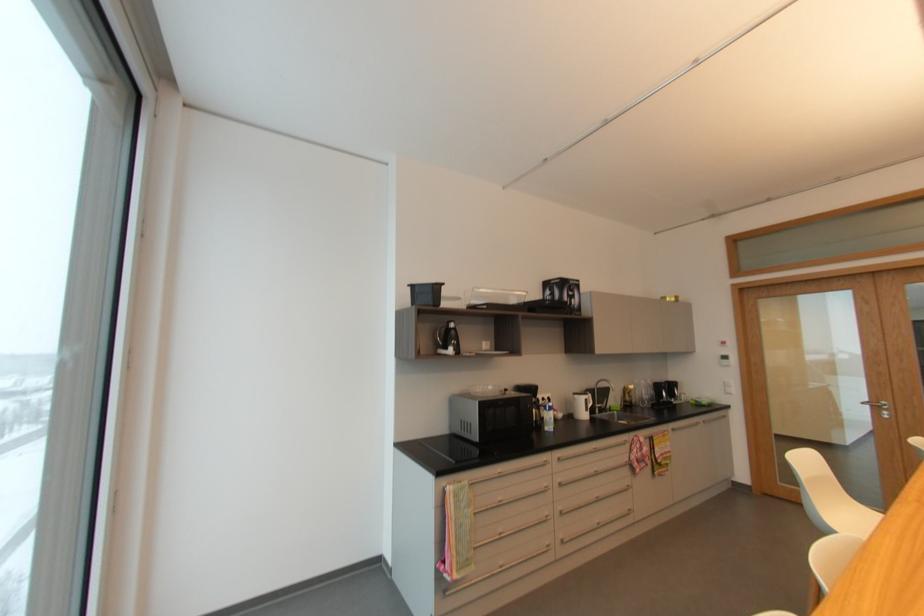
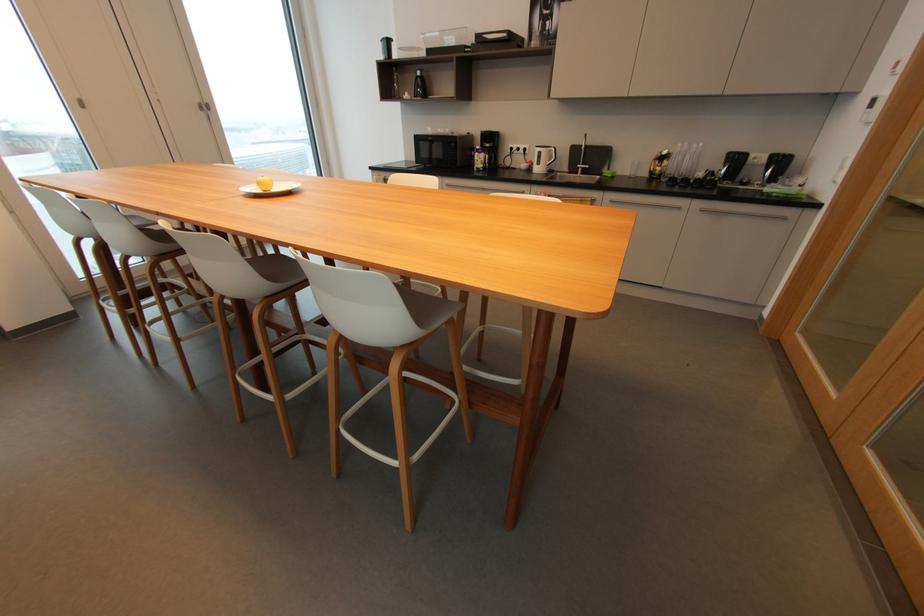
Where in the second image is the point corresponding to (700,424) from the first image?

(683, 208)